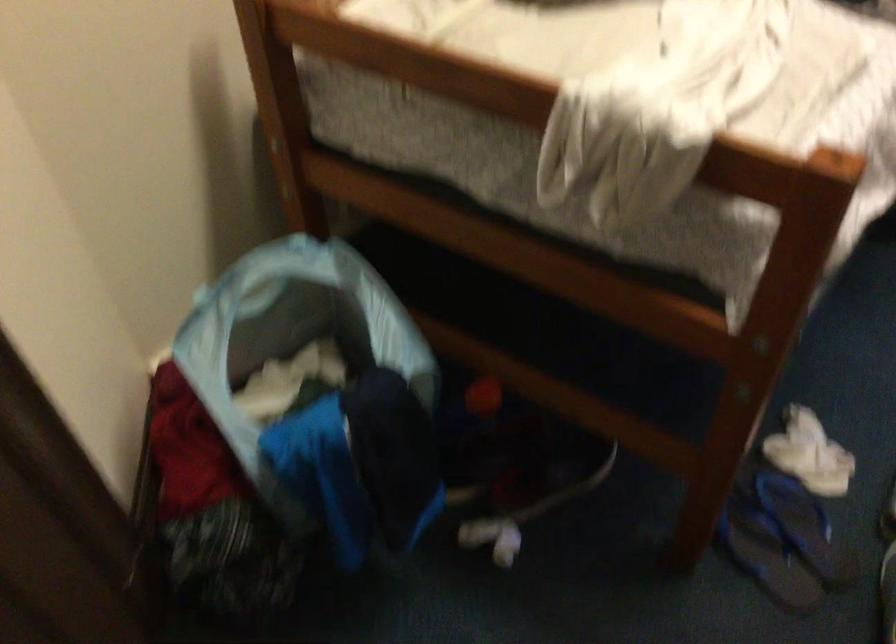
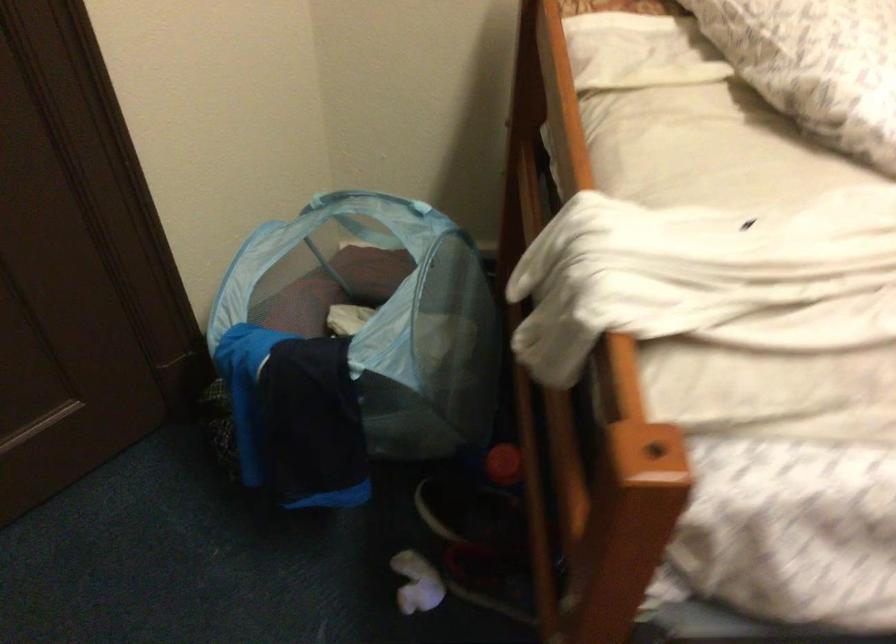
Locate, in the second image, the point that corresponds to (x=376, y=368) in the first image.

(354, 345)